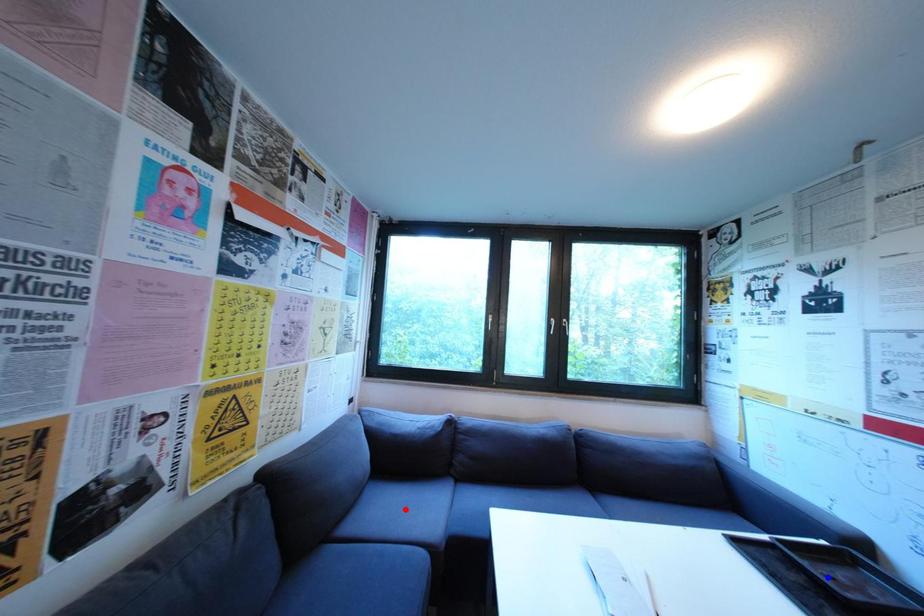
Question: Which of the two points in the image is closer to the camera?

Choices:
 (A) Blue point is closer.
 (B) Red point is closer.

Answer: (A)